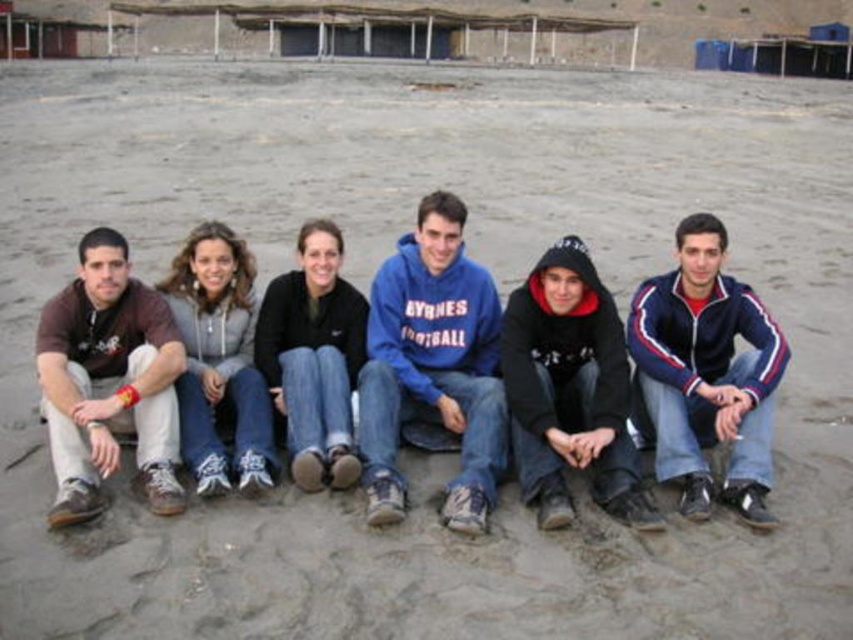
Question: Considering the real-world distances, which object is farthest from the brown cotton shirt at left?

Choices:
 (A) denim jeans at center
 (B) black fleece jacket at center
 (C) blue fleece sweatshirt at center
 (D) blue/white/red track jacket at lower right

Answer: (D)

Question: Which object is closer to the camera taking this photo?

Choices:
 (A) black hoodie at center
 (B) black fleece jacket at center
 (C) blue fleece sweatshirt at center
 (D) blue/white/red track jacket at lower right

Answer: (C)

Question: Does blue/white/red track jacket at lower right appear under brown cotton shirt at left?

Choices:
 (A) yes
 (B) no

Answer: (A)

Question: Is black hoodie at center positioned behind black fleece jacket at center?

Choices:
 (A) no
 (B) yes

Answer: (A)

Question: Is brown cotton shirt at left wider than black fleece jacket at center?

Choices:
 (A) yes
 (B) no

Answer: (B)

Question: Estimate the real-world distances between objects in this image. Which object is closer to the brown cotton shirt at left?

Choices:
 (A) blue/white/red track jacket at lower right
 (B) blue fleece sweatshirt at center

Answer: (B)